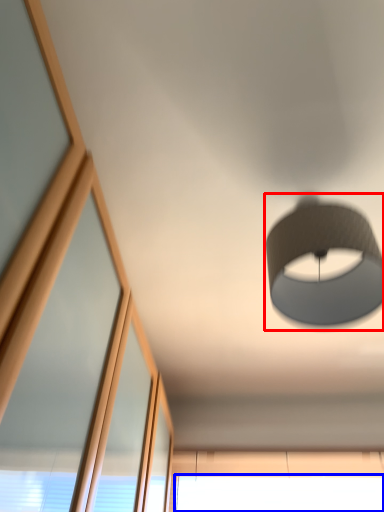
Question: Among these objects, which one is nearest to the camera, lamp (highlighted by a red box) or window (highlighted by a blue box)?

Choices:
 (A) lamp
 (B) window

Answer: (A)